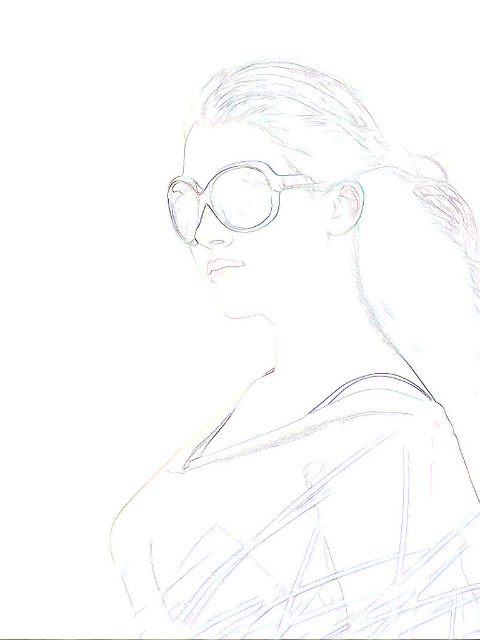
Question: Does matte plastic glasses at center appear on the right side of clear plastic glasses at center?

Choices:
 (A) yes
 (B) no

Answer: (A)

Question: Does matte plastic glasses at center have a smaller size compared to clear plastic glasses at center?

Choices:
 (A) no
 (B) yes

Answer: (A)

Question: Is matte plastic glasses at center to the left of clear plastic glasses at center from the viewer's perspective?

Choices:
 (A) no
 (B) yes

Answer: (A)

Question: Among these points, which one is nearest to the camera?

Choices:
 (A) (396, 305)
 (B) (191, 202)

Answer: (B)

Question: Which of the following is the closest to the observer?

Choices:
 (A) clear plastic glasses at center
 (B) matte plastic glasses at center

Answer: (B)